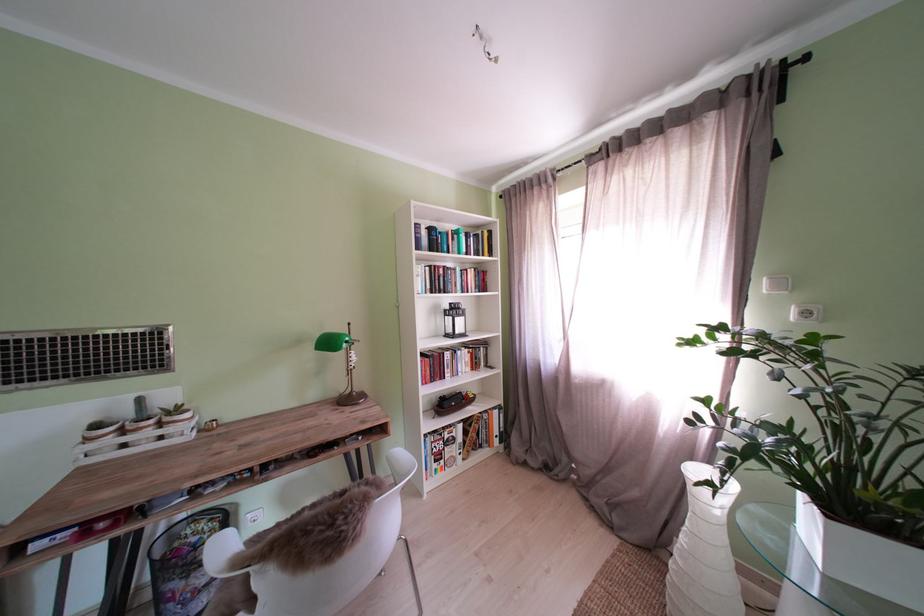
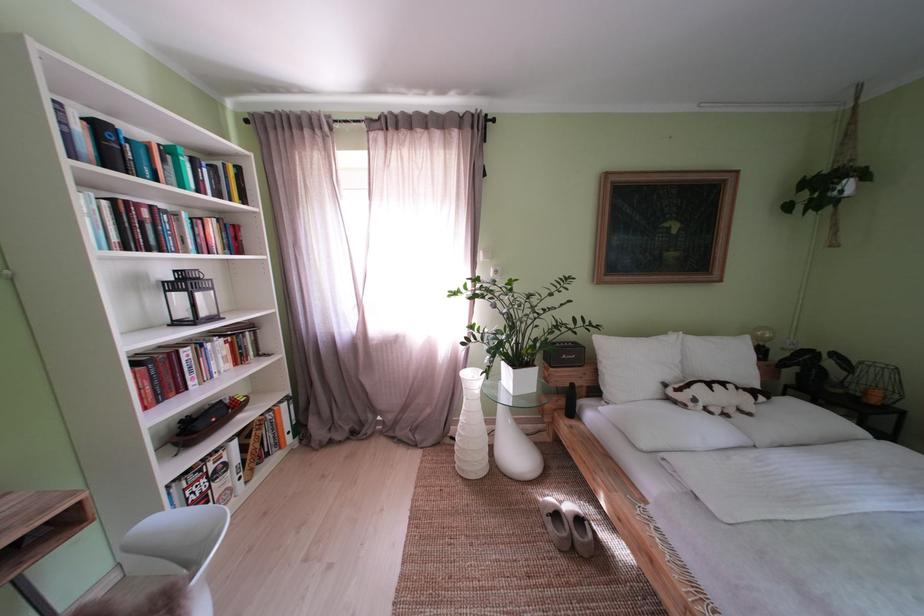
Find the pixel in the second image that matches (466,315) in the first image.

(198, 286)